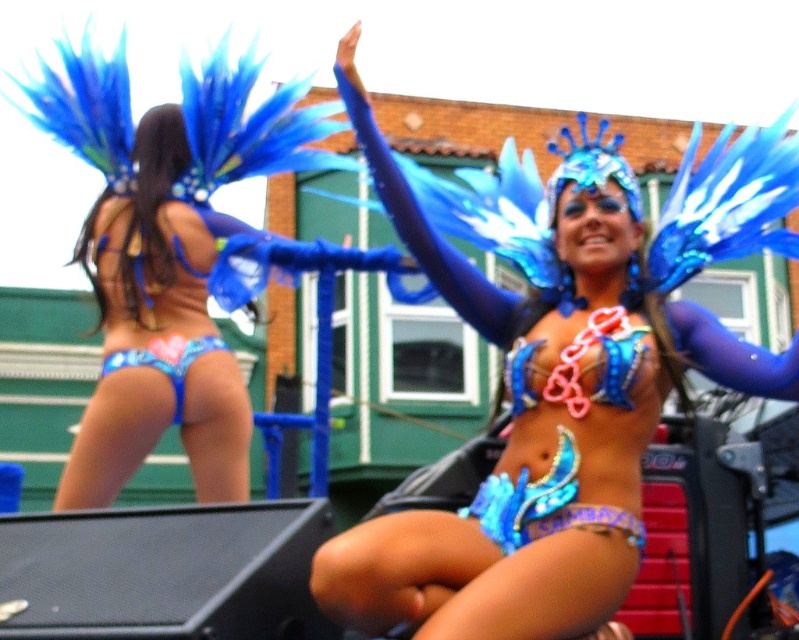
Can you confirm if shiny blue costume at center is bigger than blue sequined bikini bottom at lower left?

Yes.

Who is more distant from viewer, (x=378, y=628) or (x=171, y=358)?

Positioned behind is point (x=171, y=358).

The width and height of the screenshot is (799, 640). I want to click on shiny blue costume at center, so click(561, 380).